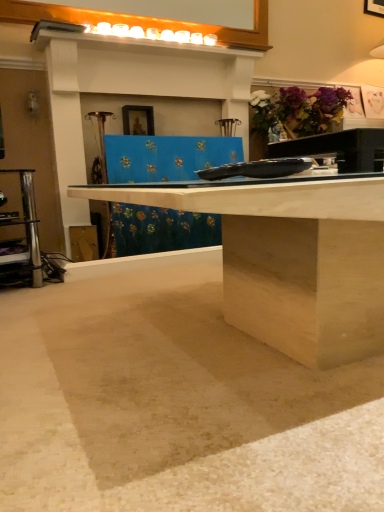
Question: Would you say purple matte flower at upper right is outside beige matte concrete at lower center?

Choices:
 (A) yes
 (B) no

Answer: (A)

Question: From the image's perspective, does purple matte flower at upper right appear lower than beige matte concrete at lower center?

Choices:
 (A) no
 (B) yes

Answer: (A)

Question: Does purple matte flower at upper right lie behind beige matte concrete at lower center?

Choices:
 (A) yes
 (B) no

Answer: (A)

Question: From a real-world perspective, is purple matte flower at upper right on beige matte concrete at lower center?

Choices:
 (A) no
 (B) yes

Answer: (B)

Question: From the image's perspective, is purple matte flower at upper right on beige matte concrete at lower center?

Choices:
 (A) yes
 (B) no

Answer: (A)

Question: Considering the positions of purple matte flower at upper right and beige matte concrete at lower center in the image, is purple matte flower at upper right bigger or smaller than beige matte concrete at lower center?

Choices:
 (A) big
 (B) small

Answer: (B)

Question: Does point (327, 88) appear closer or farther from the camera than point (99, 352)?

Choices:
 (A) closer
 (B) farther

Answer: (B)

Question: Visually, is purple matte flower at upper right positioned to the left or to the right of beige matte concrete at lower center?

Choices:
 (A) right
 (B) left

Answer: (A)

Question: Is purple matte flower at upper right taller or shorter than beige matte concrete at lower center?

Choices:
 (A) short
 (B) tall

Answer: (B)

Question: Would you say beige matte concrete at lower center is to the left or to the right of wooden framed picture at upper center in the picture?

Choices:
 (A) left
 (B) right

Answer: (B)

Question: From the image's perspective, relative to wooden framed picture at upper center, is beige matte concrete at lower center above or below?

Choices:
 (A) below
 (B) above

Answer: (A)

Question: Is beige matte concrete at lower center wider or thinner than wooden framed picture at upper center?

Choices:
 (A) thin
 (B) wide

Answer: (B)

Question: Considering the positions of beige matte concrete at lower center and wooden framed picture at upper center in the image, is beige matte concrete at lower center bigger or smaller than wooden framed picture at upper center?

Choices:
 (A) small
 (B) big

Answer: (B)

Question: From the image's perspective, is beige matte concrete at lower center located above or below purple matte flower at upper right?

Choices:
 (A) above
 (B) below

Answer: (B)

Question: Is point (218, 309) closer or farther from the camera than point (266, 101)?

Choices:
 (A) farther
 (B) closer

Answer: (B)